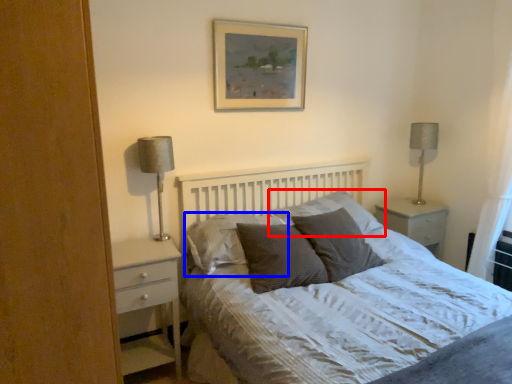
Question: Which object is closer to the camera taking this photo, pillow (highlighted by a red box) or pillow (highlighted by a blue box)?

Choices:
 (A) pillow
 (B) pillow

Answer: (B)